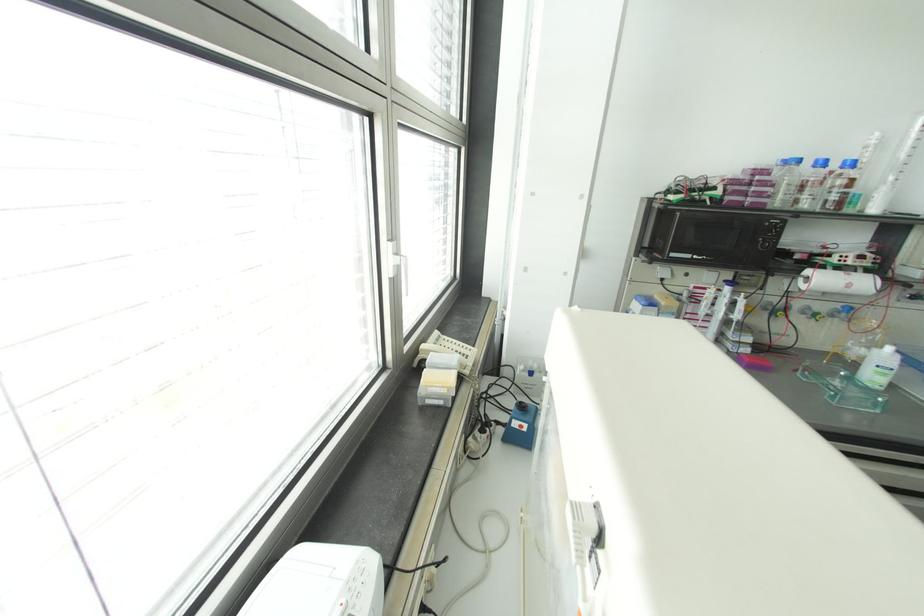
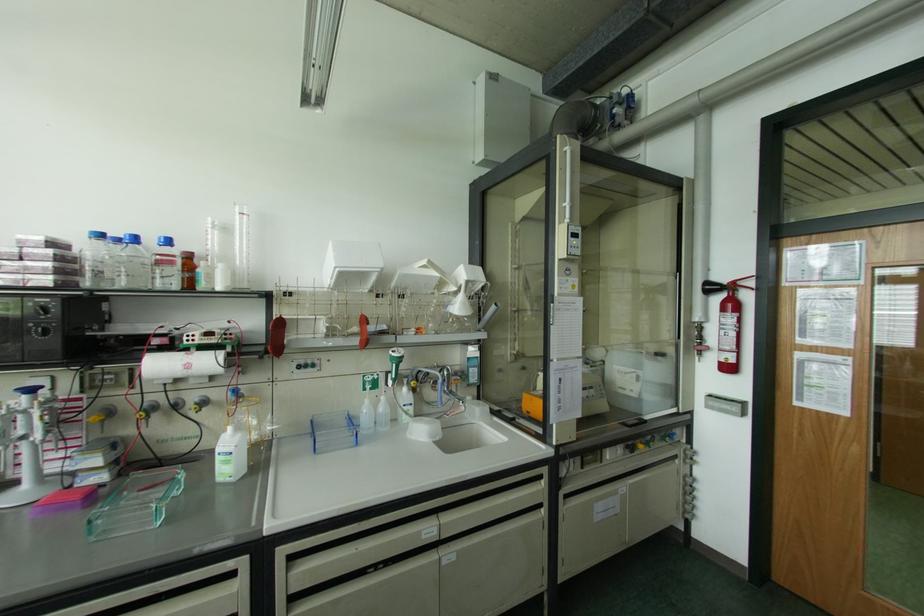
The point at [822,163] is marked in the first image. Where is the corresponding point in the second image?

(134, 238)